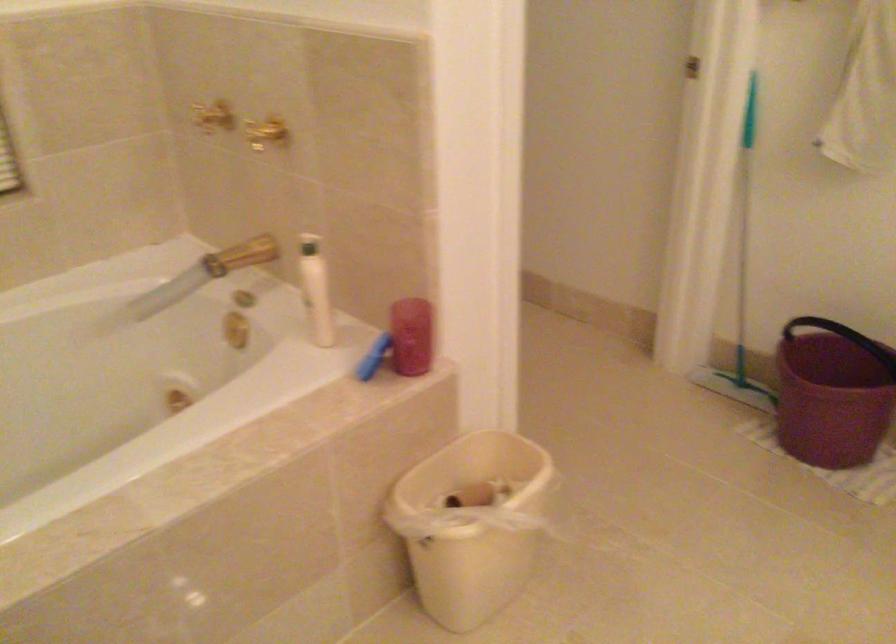
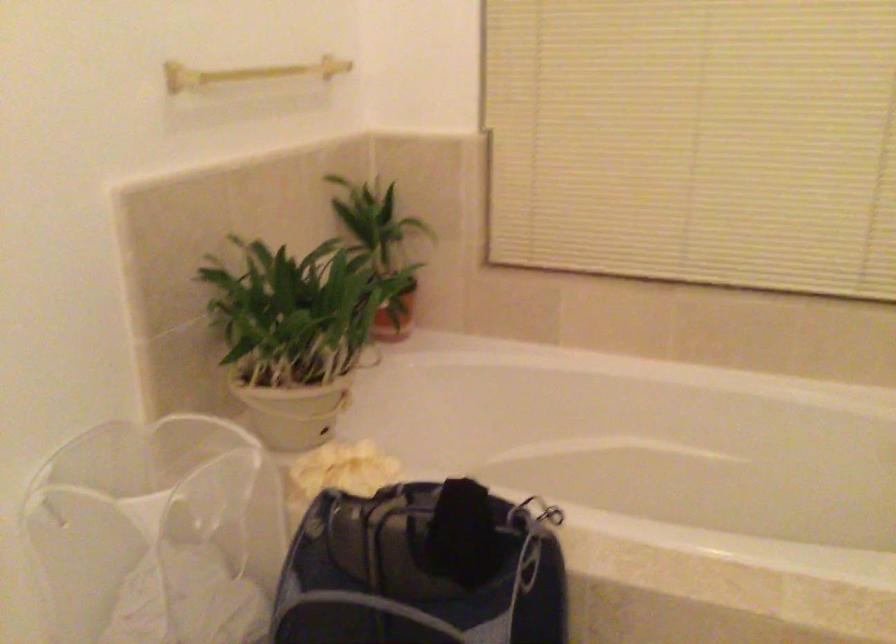
Question: How did the camera likely rotate?

Choices:
 (A) Left
 (B) Right
 (C) Up
 (D) Down

Answer: (A)